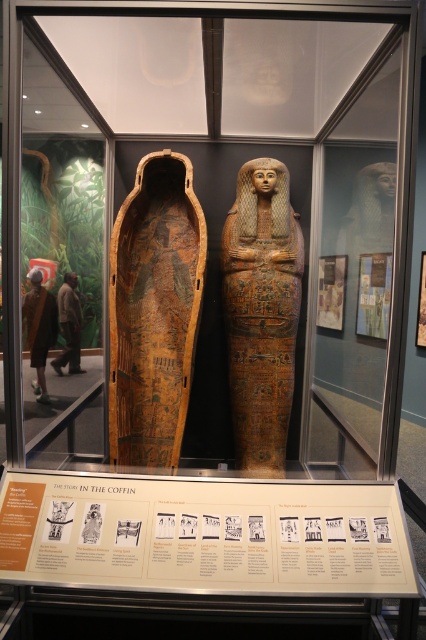
Between wooden sarcophagus at center and golden polished sarcophagus at center, which one appears on the right side from the viewer's perspective?

From the viewer's perspective, golden polished sarcophagus at center appears more on the right side.

Between point (166, 429) and point (287, 292), which one is positioned behind?

Point (166, 429)

The image size is (426, 640). In order to click on wooden sarcophagus at center in this screenshot , I will do `click(154, 310)`.